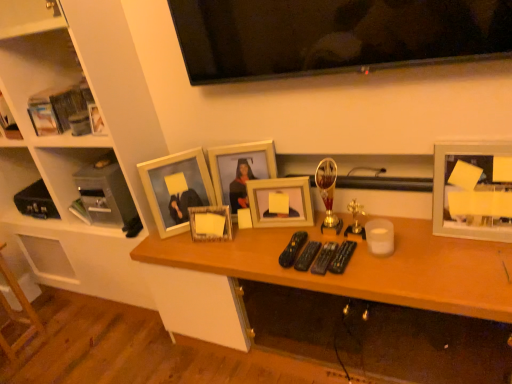
Question: Considering their positions, is flat screen tv at upper center located in front of or behind matte wooden picture frame at center, which is the third picture frame in left-to-right order?

Choices:
 (A) behind
 (B) front

Answer: (B)

Question: Considering the positions of flat screen tv at upper center and matte wooden picture frame at center, the 3th picture frame when ordered from right to left, in the image, is flat screen tv at upper center taller or shorter than matte wooden picture frame at center, the 3th picture frame when ordered from right to left,?

Choices:
 (A) tall
 (B) short

Answer: (B)

Question: Which object is the closest to the matte wooden picture frame at center, which appears as the 5th picture frame when viewed from the right?

Choices:
 (A) matte wooden picture frame at center, which is the third picture frame in left-to-right order
 (B) matte gray cabinet at left
 (C) wooden desk at center
 (D) wooden stool at lower left, the 1th furniture when ordered from bottom to top
 (E) white wood shelf at upper left, acting as the 1th furniture starting from the top

Answer: (A)

Question: Estimate the real-world distances between objects in this image. Which object is farther from the wooden desk at center?

Choices:
 (A) matte gray cabinet at left
 (B) white matte picture frame at right, acting as the fifth picture frame starting from the left
 (C) matte wooden picture frame at center, which is the third picture frame in left-to-right order
 (D) wooden stool at lower left, the 1th furniture when ordered from bottom to top
 (E) matte wooden picture frame at center, arranged as the 1th picture frame when viewed from the left

Answer: (D)